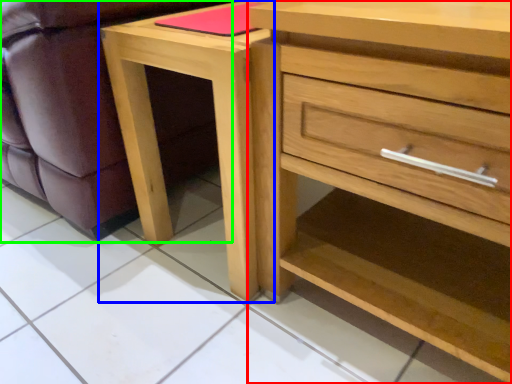
Question: Which object is positioned closest to chest of drawers (highlighted by a red box)? Select from nightstand (highlighted by a blue box) and swivel chair (highlighted by a green box).

Choices:
 (A) nightstand
 (B) swivel chair

Answer: (A)